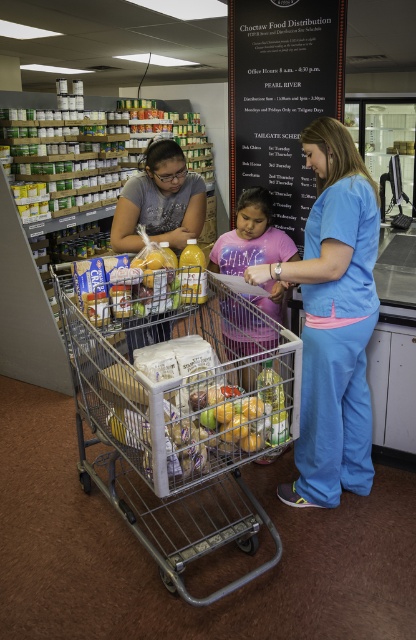
Does blue scrubs at center appear under pink cotton shirt at center?

Yes.

Is the position of blue scrubs at center less distant than that of pink cotton shirt at center?

That is True.

What do you see at coordinates (334, 321) in the screenshot? The width and height of the screenshot is (416, 640). I see `blue scrubs at center` at bounding box center [334, 321].

Where is `blue scrubs at center`? This screenshot has height=640, width=416. blue scrubs at center is located at coordinates (334, 321).

Can you confirm if metallic silver trolley at center is positioned to the left of matte plastic bag of chips at center?

Indeed, metallic silver trolley at center is positioned on the left side of matte plastic bag of chips at center.

Does metallic silver trolley at center appear on the right side of matte plastic bag of chips at center?

Incorrect, metallic silver trolley at center is not on the right side of matte plastic bag of chips at center.

Between point (230, 529) and point (158, 378), which one is positioned behind?

Point (230, 529)

You are a GUI agent. You are given a task and a screenshot of the screen. Output one action in this format:
    pyautogui.click(x=<x>, y=<y>)
    Task: Click on the metallic silver trolley at center
    The width and height of the screenshot is (416, 640).
    Given the screenshot: What is the action you would take?
    pyautogui.click(x=178, y=442)

From the picture: Does matte plastic bag of chips at center lie behind matte gray shirt at center?

No, matte plastic bag of chips at center is closer to the viewer.

Is matte plastic bag of chips at center smaller than matte gray shirt at center?

Actually, matte plastic bag of chips at center might be larger than matte gray shirt at center.

Locate an element on the screen. This screenshot has width=416, height=640. matte plastic bag of chips at center is located at coordinates (212, 404).

The width and height of the screenshot is (416, 640). Identify the location of matte plastic bag of chips at center. (212, 404).